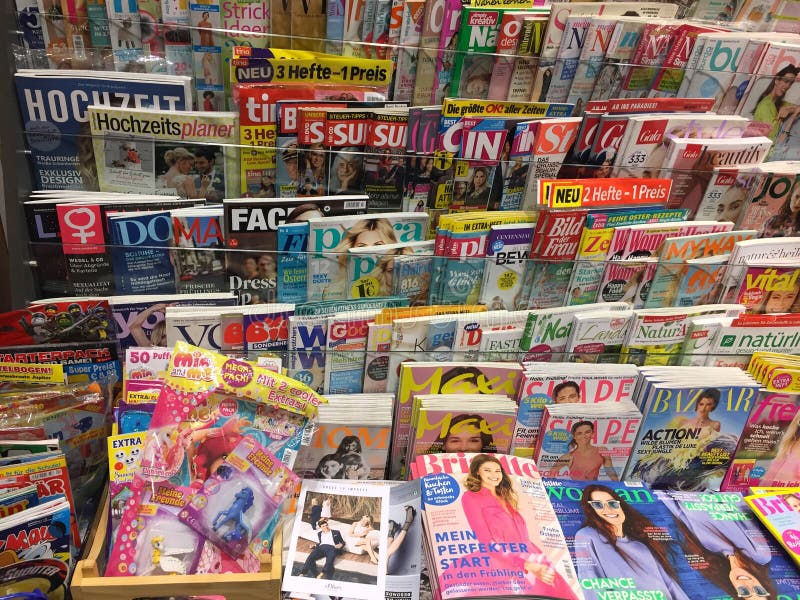
Image resolution: width=800 pixels, height=600 pixels. What are the coordinates of `back rack of magazines` in the screenshot? It's located at (494, 23).